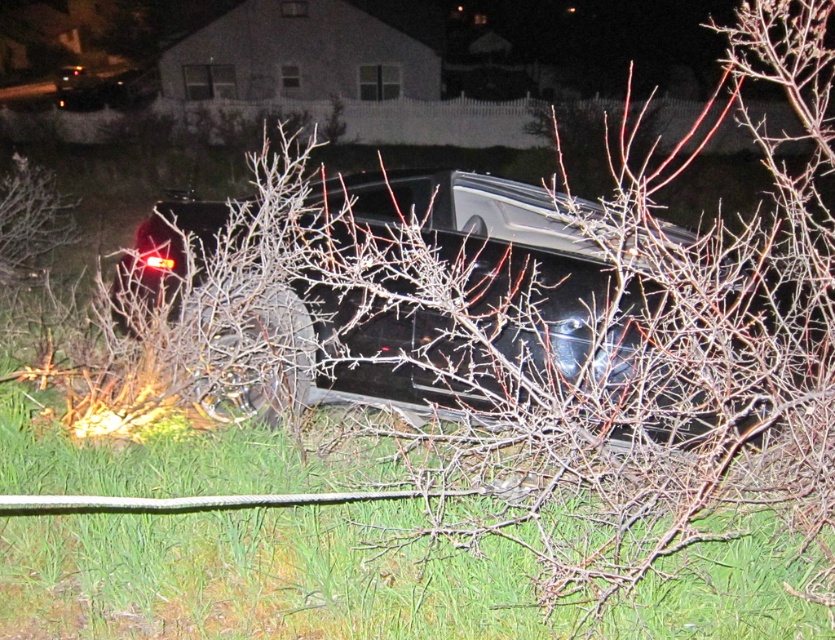
You are a safety officer assessing the accident scene. You need to determine if the green grass at lower center can be used to temporarily secure the glossy black car at center. Based on their heights, can the grass be used as an anchor point?

The green grass at lower center is shorter than the glossy black car at center. Since the grass is shorter, it may not provide sufficient height to effectively secure the car. Consider using the nearby white rope barrier or other elevated structures instead.

You are a safety officer assessing the accident scene. You see the green grass at lower center and the glossy black car at center. Which object is closer to you, the observer?

The green grass at lower center is closer to you because it is in front of the glossy black car at center.